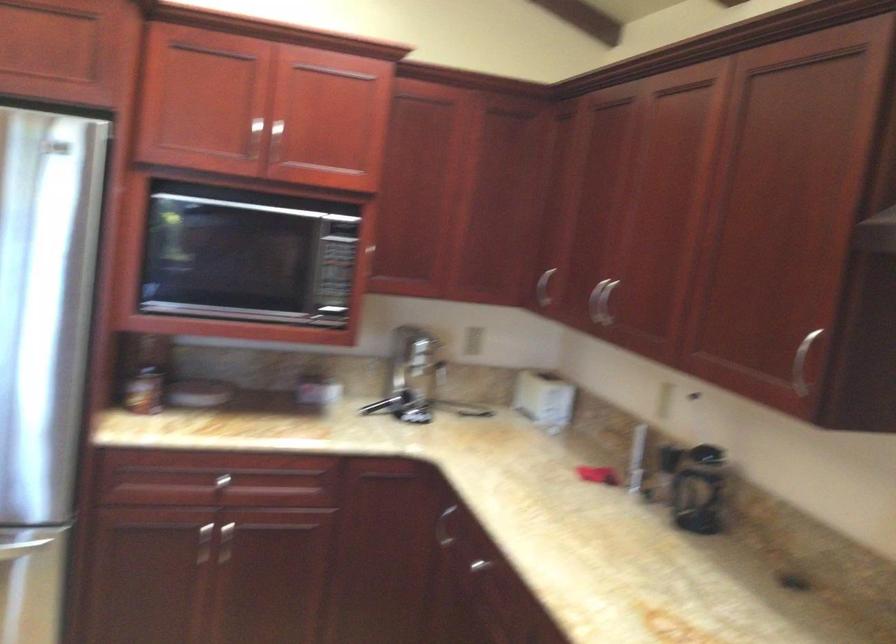
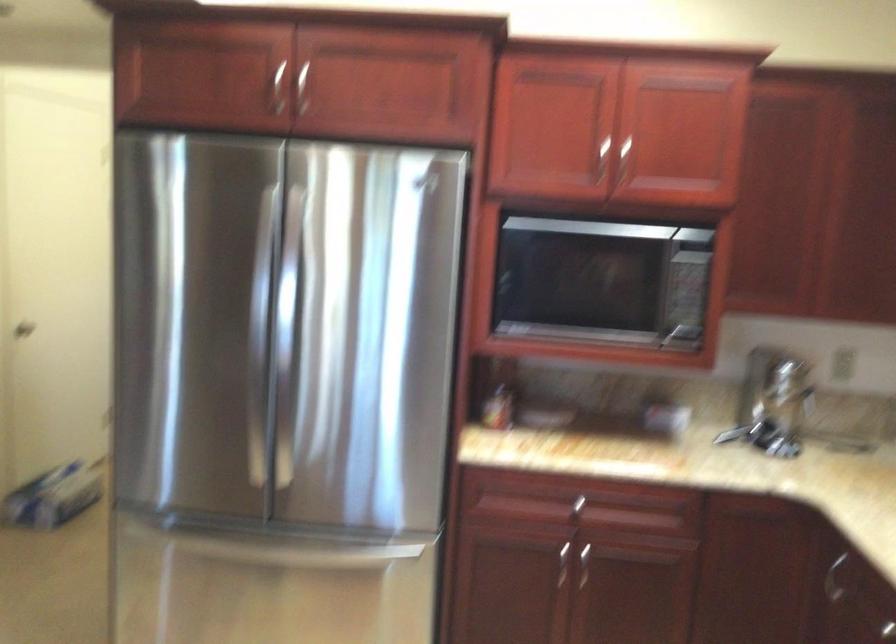
Question: How did the camera likely rotate?

Choices:
 (A) Left
 (B) Right
 (C) Up
 (D) Down

Answer: (A)